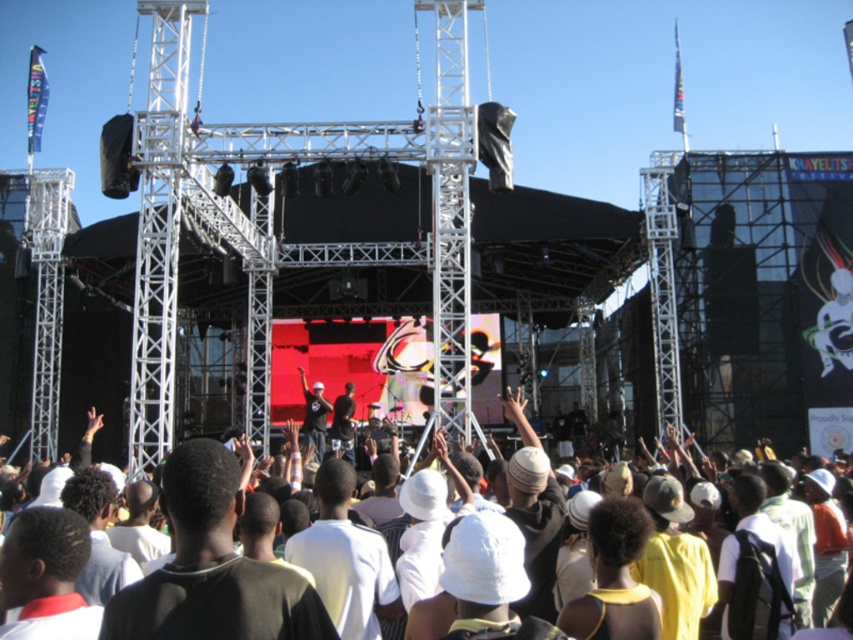
Question: Is white cotton crowd at center to the left of matte black shirt at center from the viewer's perspective?

Choices:
 (A) yes
 (B) no

Answer: (B)

Question: Which object is farther from the camera taking this photo?

Choices:
 (A) white cotton crowd at center
 (B) matte black shirt at center

Answer: (B)

Question: Which point appears farthest from the camera in this image?

Choices:
 (A) (309, 436)
 (B) (717, 536)

Answer: (A)

Question: Can you confirm if white cotton crowd at center is positioned to the left of matte black shirt at center?

Choices:
 (A) no
 (B) yes

Answer: (A)

Question: Can you confirm if white cotton crowd at center is positioned to the left of matte black shirt at center?

Choices:
 (A) yes
 (B) no

Answer: (B)